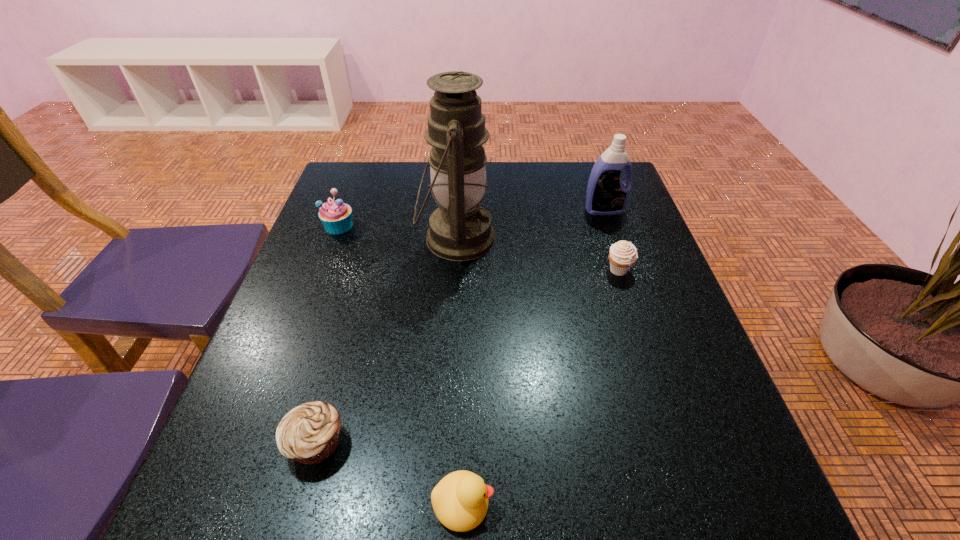
Where is `empty space that is in between the oil lamp and the rightmost muffin`? empty space that is in between the oil lamp and the rightmost muffin is located at coordinates (538, 254).

At what (x,y) coordinates should I click in order to perform the action: click on empty space that is in between the second muffin from right to left and the nearest object. Please return your answer as a coordinate pair (x, y). The image size is (960, 540). Looking at the image, I should click on (389, 473).

Locate an element on the screen. Image resolution: width=960 pixels, height=540 pixels. vacant area that lies between the fifth farthest object and the detergent is located at coordinates (460, 326).

This screenshot has width=960, height=540. I want to click on vacant region between the tallest object and the duckling, so click(x=460, y=371).

Identify the location of object that is the fourth closest to the oil lamp. (310, 433).

Locate which object is the closest to the second tallest object. Please provide its 2D coordinates. Your answer should be formatted as a tuple, i.e. [(x, y)], where the tuple contains the x and y coordinates of a point satisfying the conditions above.

[(623, 254)]

Locate which muffin ranks third in proximity to the detergent. Please provide its 2D coordinates. Your answer should be formatted as a tuple, i.e. [(x, y)], where the tuple contains the x and y coordinates of a point satisfying the conditions above.

[(310, 433)]

Identify which muffin is the third nearest to the detergent. Please provide its 2D coordinates. Your answer should be formatted as a tuple, i.e. [(x, y)], where the tuple contains the x and y coordinates of a point satisfying the conditions above.

[(310, 433)]

Identify the location of free spot that satisfies the following two spatial constraints: 1. on the back side of the detergent; 2. on the left side of the leftmost object. (345, 210).

The width and height of the screenshot is (960, 540). In order to click on vacant region that satisfies the following two spatial constraints: 1. on the back side of the second tallest object; 2. on the right side of the leftmost object in this screenshot , I will do `click(345, 210)`.